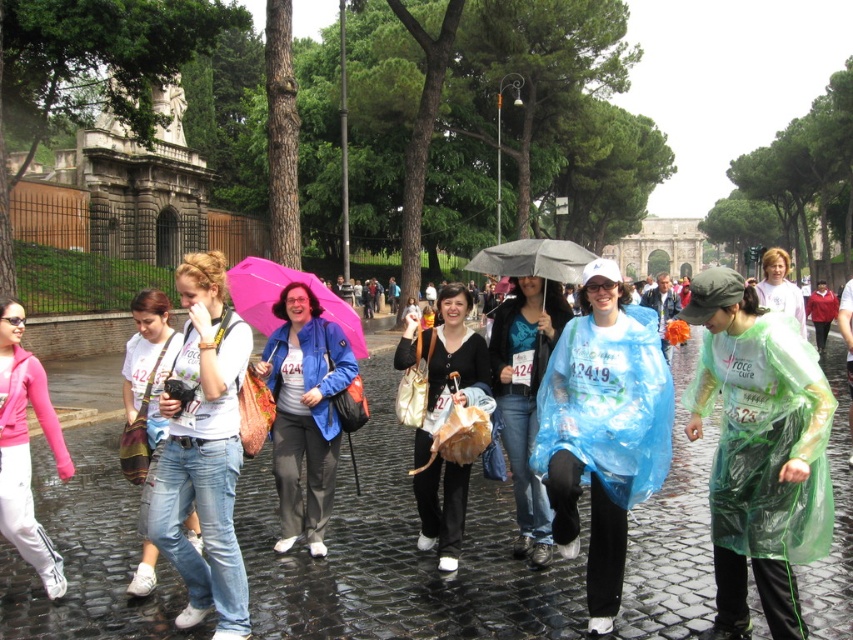
You are standing at the starting line of the event and want to reach both the point at coordinates point (766, 620) and point (432, 413). Which point will you reach first if you move towards them directly?

You will reach point (766, 620) first because it is closer to you than point (432, 413).

You are a photographer trying to capture a photo of the light green plastic poncho at center without including the pink fleece jacket at lower left in the frame. Is this possible given their positions?

The pink fleece jacket at lower left is positioned under the light green plastic poncho at center, so adjusting the camera angle upward might exclude the pink fleece jacket at lower left while focusing on the light green plastic poncho at center.